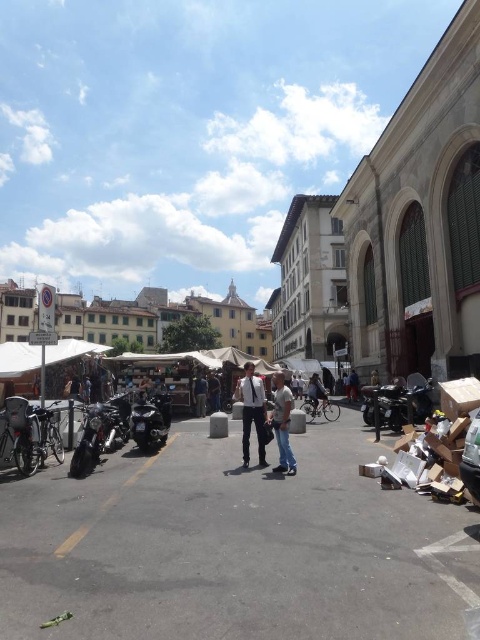
Question: Which of the following is the closest to the observer?

Choices:
 (A) (286, 444)
 (B) (162, 404)
 (C) (205, 401)

Answer: (A)

Question: Which point is farther from the camera taking this photo?

Choices:
 (A) coord(196,413)
 (B) coord(320,396)
 (C) coord(155,428)

Answer: (A)

Question: Estimate the real-world distances between objects in this image. Which object is closer to the shiny black motorcycle at center-left?

Choices:
 (A) dark blue jeans at center
 (B) shiny black motorcycle at right
 (C) dark gray fabric jacket at center
 (D) denim jeans at center

Answer: (D)

Question: Can you confirm if light blue denim jeans at center is thinner than dark gray fabric jacket at center?

Choices:
 (A) yes
 (B) no

Answer: (B)

Question: Does denim jeans at center lie behind dark blue jeans at center?

Choices:
 (A) yes
 (B) no

Answer: (B)

Question: Is shiny black motorcycle at center-left to the right of denim jeans at center from the viewer's perspective?

Choices:
 (A) yes
 (B) no

Answer: (B)